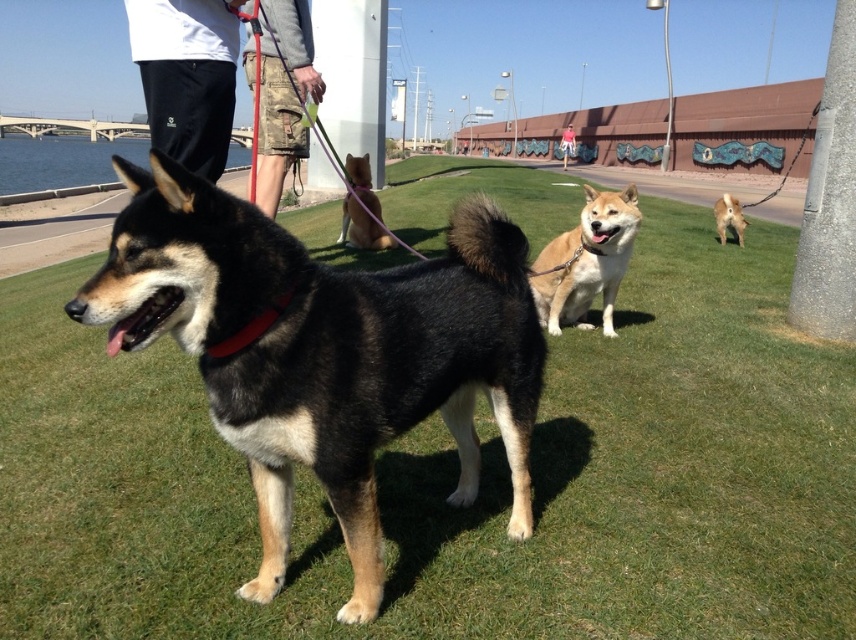
Based on the photo, you are standing at the point with coordinates point (300,90) and want to walk towards the point with coordinates point (438,292). Which direction should you go?

You should walk forward because point (438,292) is in front of point (300,90).

You are a photographer trying to capture a shot of the light brown fur at center and the black cotton pants at upper left. Which object is positioned higher in the frame?

The black cotton pants at upper left is located above light brown fur at center, so it is positioned higher in the frame.